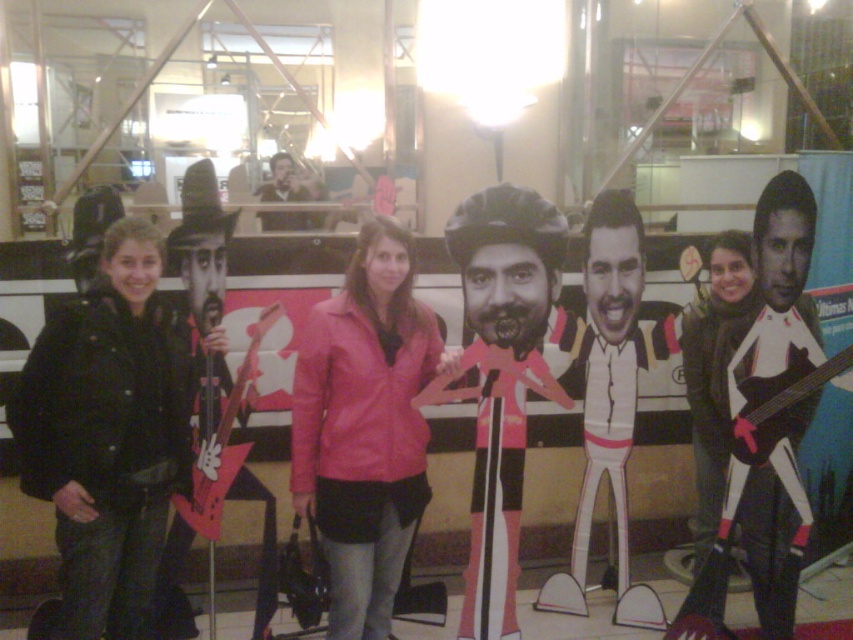
Question: Based on their relative distances, which object is nearer to the white cardboard figure at center?

Choices:
 (A) black leather jacket at left
 (B) pink cardboard man at center

Answer: (B)

Question: Which object is farther from the camera taking this photo?

Choices:
 (A) black leather jacket at left
 (B) white cardboard figure at center
 (C) pink cardboard man at center

Answer: (B)

Question: Which object is farther from the camera taking this photo?

Choices:
 (A) pink cardboard man at center
 (B) pink leather jacket at center
 (C) white matte guitar at right

Answer: (C)

Question: Can you confirm if pink cardboard man at center is wider than white matte guitar at right?

Choices:
 (A) no
 (B) yes

Answer: (B)

Question: Can you confirm if black leather jacket at left is wider than pink leather jacket at center?

Choices:
 (A) yes
 (B) no

Answer: (B)

Question: Does black leather jacket at left appear on the right side of white cardboard figure at center?

Choices:
 (A) no
 (B) yes

Answer: (A)